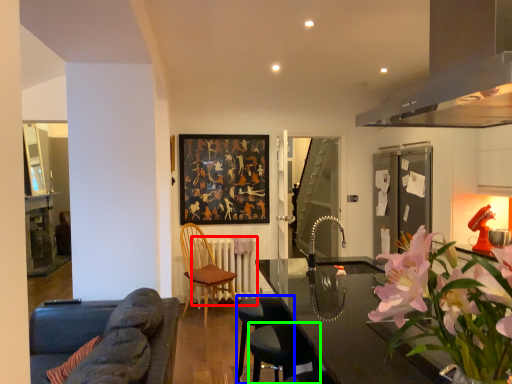
Question: Which object is the farthest from radiator (highlighted by a red box)? Choose among these: bar stool (highlighted by a blue box) or bar stool (highlighted by a green box).

Choices:
 (A) bar stool
 (B) bar stool

Answer: (B)